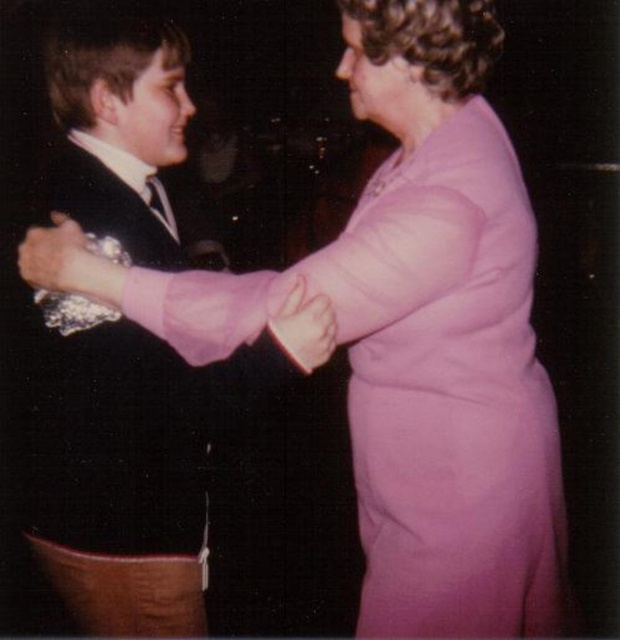
Question: Which of the following is the farthest from the observer?

Choices:
 (A) metallic silver bracelet at upper left
 (B) black satin suit at left

Answer: (B)

Question: Is pink satin dress at center closer to the viewer compared to black satin suit at left?

Choices:
 (A) yes
 (B) no

Answer: (A)

Question: Does pink satin dress at center have a smaller size compared to matte pink sleeve at upper center?

Choices:
 (A) no
 (B) yes

Answer: (A)

Question: Can you confirm if pink satin dress at center is smaller than black satin suit at left?

Choices:
 (A) no
 (B) yes

Answer: (A)

Question: Which point is closer to the camera taking this photo?

Choices:
 (A) (316, 344)
 (B) (182, 67)
 (C) (51, 268)
 (D) (361, 636)

Answer: (A)

Question: Which point is farther to the camera?

Choices:
 (A) (55, 268)
 (B) (310, 264)
 (C) (133, 90)

Answer: (C)